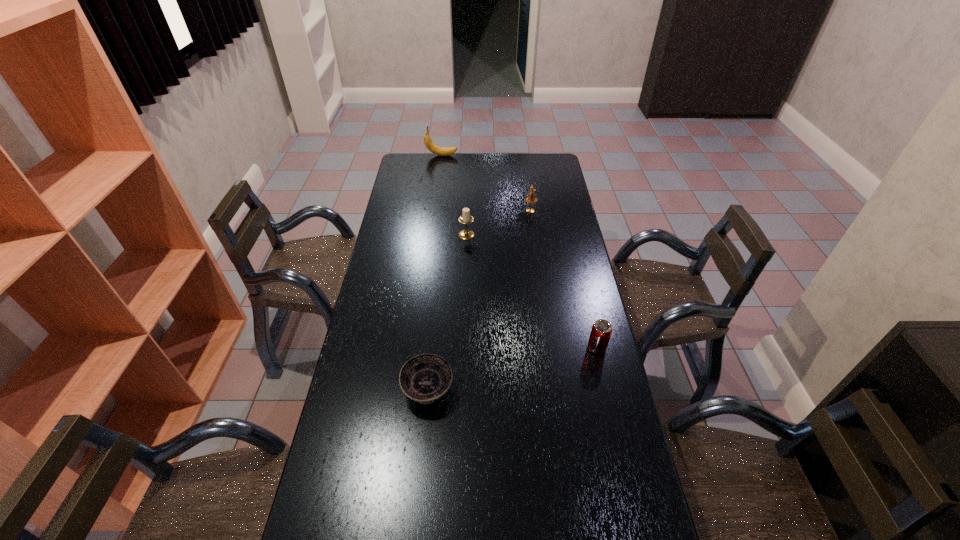
The width and height of the screenshot is (960, 540). In order to click on banana in this screenshot , I will do `click(442, 151)`.

At what (x,y) coordinates should I click in order to perform the action: click on the tallest object. Please return your answer as a coordinate pair (x, y). Looking at the image, I should click on (442, 151).

Identify the location of the left candle holder. Image resolution: width=960 pixels, height=540 pixels. (466, 218).

You are a GUI agent. You are given a task and a screenshot of the screen. Output one action in this format:
    pyautogui.click(x=<x>, y=<y>)
    Task: Click on the third nearest object
    
    Given the screenshot: What is the action you would take?
    pyautogui.click(x=466, y=218)

You are a GUI agent. You are given a task and a screenshot of the screen. Output one action in this format:
    pyautogui.click(x=<x>, y=<y>)
    Task: Click on the right candle holder
    The height and width of the screenshot is (540, 960).
    Given the screenshot: What is the action you would take?
    pyautogui.click(x=531, y=198)

The image size is (960, 540). I want to click on the second object from right to left, so point(531,198).

The image size is (960, 540). Find the location of `soda can`. soda can is located at coordinates (601, 331).

This screenshot has width=960, height=540. Find the location of `the fourth farthest object`. the fourth farthest object is located at coordinates (601, 331).

The height and width of the screenshot is (540, 960). In order to click on the nearest object in this screenshot , I will do `click(424, 378)`.

What are the coordinates of `the shortest object` in the screenshot? It's located at (424, 378).